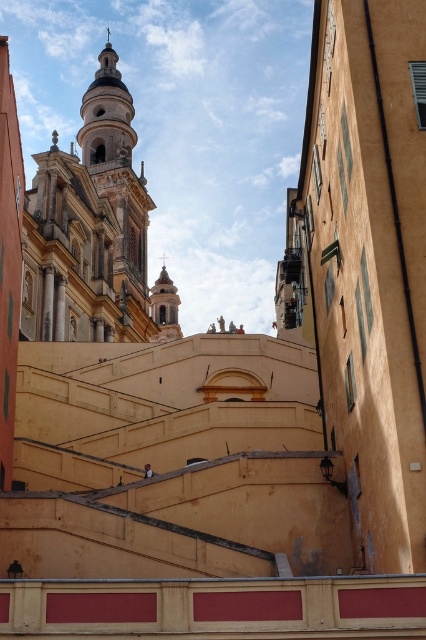
You are an architect analyzing the urban layout of this historic European city. Based on the image, which structure occupies a larger horizontal space between the white marble church at upper center and the smooth white tower at center?

The white marble church at upper center might be wider than the smooth white tower at center, so it likely occupies a larger horizontal space between them.

You are standing at the base of the grand staircase in the image. You want to take a photo of the white marble church at upper center. In which direction should you aim your camera to capture it in the frame?

The white marble church at upper center is located at point 0.362 on the x and 0.218 on the y coordinates, so you should aim your camera towards the upper center direction to capture it in the frame.

You are an architect analyzing the urban scene. Given that the white marble church at upper center and the smooth white tower at center are both key structures, which one has a greater overall size according to the scene?

The white marble church at upper center is larger in size than the smooth white tower at center, so it has a greater overall size.